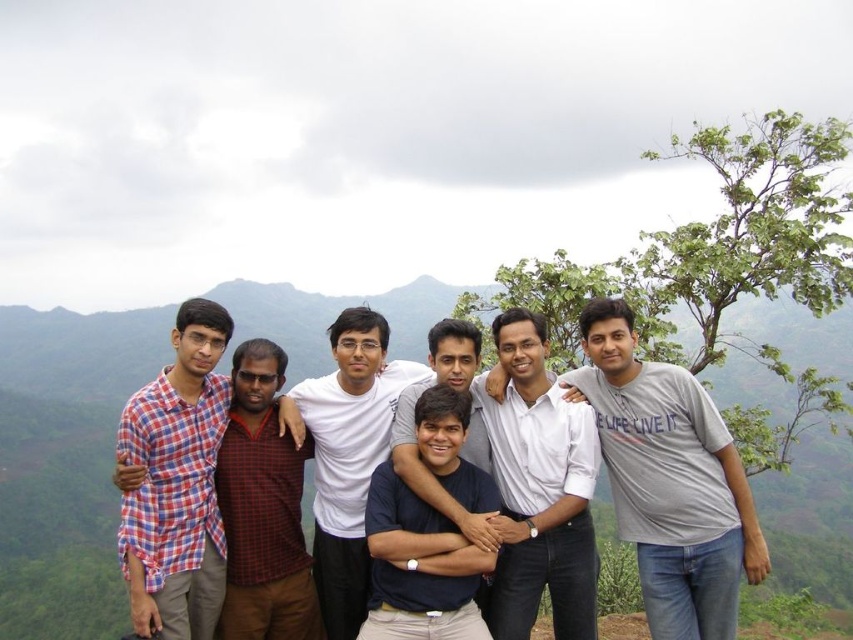
You are standing in the group photo and want to find the person wearing a white shirt at center. Which direction should you look to find the point at coordinate (538, 490)?

The point at coordinate (538, 490) is located on the white shirt at center, so you should look towards the center of the group to find it.